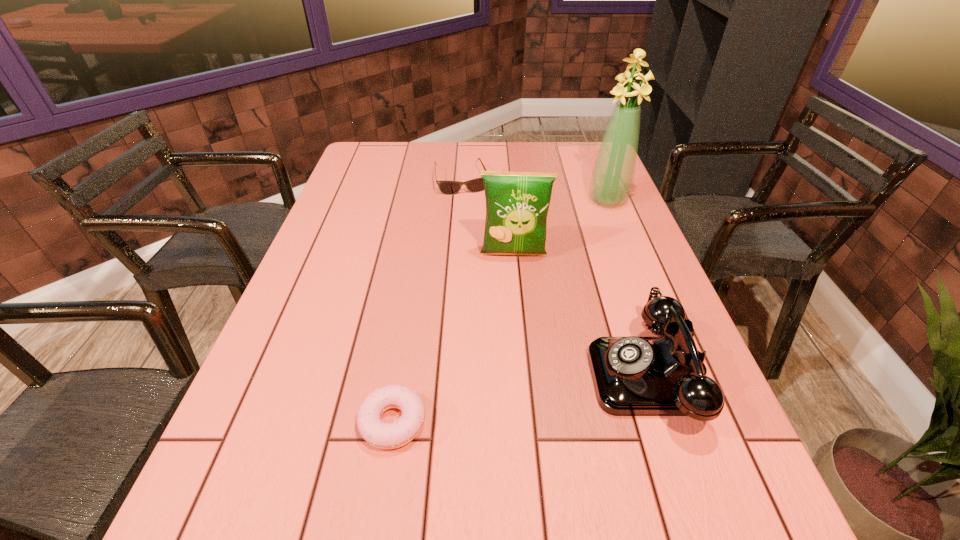
Locate an element on the screen. The height and width of the screenshot is (540, 960). doughnut is located at coordinates (382, 435).

At what (x,y) coordinates should I click in order to perform the action: click on the third shortest object. Please return your answer as a coordinate pair (x, y). Looking at the image, I should click on (633, 376).

The height and width of the screenshot is (540, 960). Identify the location of sunglasses. (475, 185).

Find the location of a particular element. the third nearest object is located at coordinates (517, 203).

Locate an element on the screen. This screenshot has width=960, height=540. crisp (potato chip) is located at coordinates click(517, 203).

Where is `the tallest object`? This screenshot has height=540, width=960. the tallest object is located at coordinates (613, 173).

Identify the location of free space located on the right of the doughnut. This screenshot has width=960, height=540. (517, 422).

The image size is (960, 540). I want to click on vacant region located on the dial of the telephone, so click(431, 374).

Locate an element on the screen. vacant space located on the dial of the telephone is located at coordinates (402, 374).

The height and width of the screenshot is (540, 960). What are the coordinates of `free spot located on the dial of the telephone` in the screenshot? It's located at (480, 374).